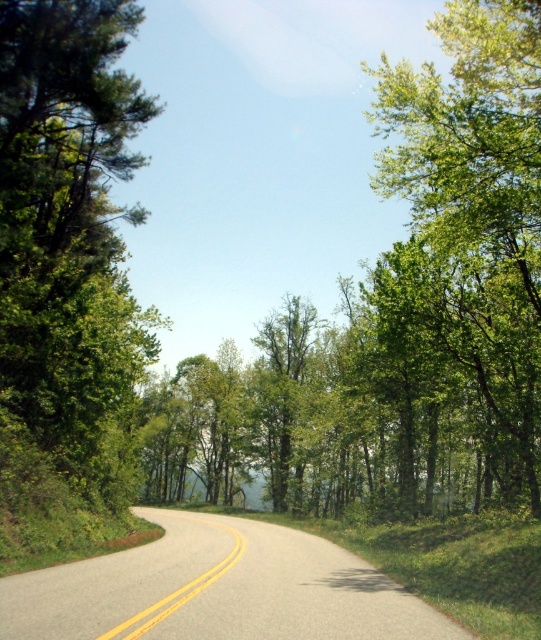
Which is in front, point (36, 96) or point (463, 212)?

Point (463, 212) is more forward.

Which is more to the left, green leafy tree at left or green leafy tree at upper right?

green leafy tree at left

Which is in front, point (115, 392) or point (478, 220)?

Point (478, 220) is more forward.

The width and height of the screenshot is (541, 640). I want to click on green leafy tree at left, so click(67, 220).

Is green leafy tree at upper right to the left of green leafy tree at center from the viewer's perspective?

No, green leafy tree at upper right is not to the left of green leafy tree at center.

Is point (498, 200) less distant than point (278, 419)?

Yes, it is.

Between point (510, 314) and point (293, 365), which one is positioned behind?

Positioned behind is point (293, 365).

Locate an element on the screen. This screenshot has width=541, height=640. green leafy tree at upper right is located at coordinates (472, 204).

Can you confirm if green leafy tree at left is smaller than green leafy tree at center?

Correct, green leafy tree at left occupies less space than green leafy tree at center.

Is point (22, 80) farther from camera compared to point (263, 401)?

No, (22, 80) is in front of (263, 401).

Identify the location of green leafy tree at left. (67, 220).